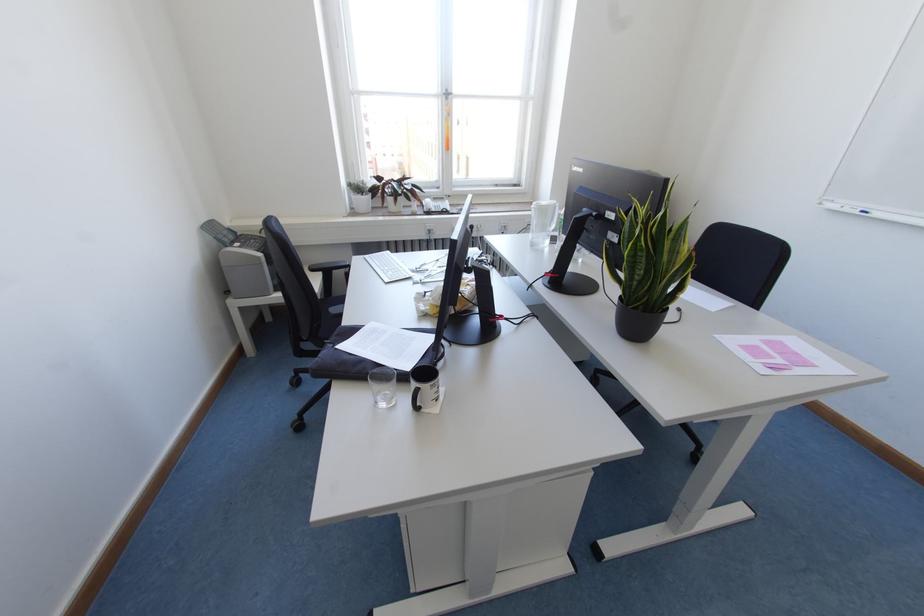
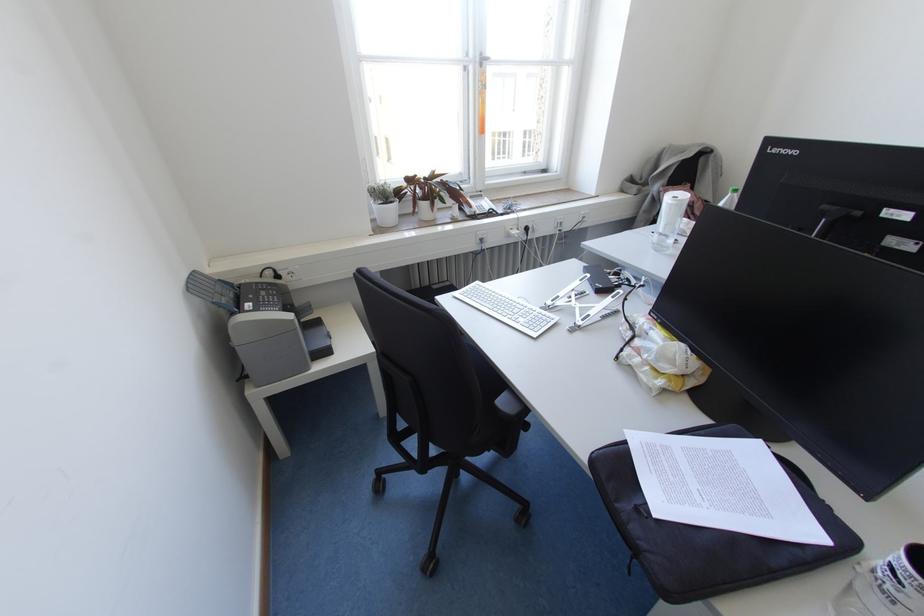
The point at (x=444, y=209) is marked in the first image. Where is the corresponding point in the second image?

(490, 209)